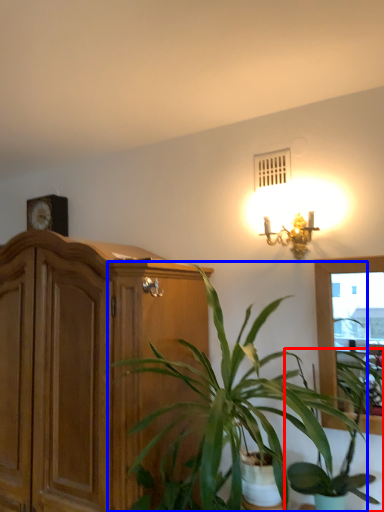
Question: Which of the following is the closest to the observer, houseplant (highlighted by a red box) or houseplant (highlighted by a blue box)?

Choices:
 (A) houseplant
 (B) houseplant

Answer: (B)